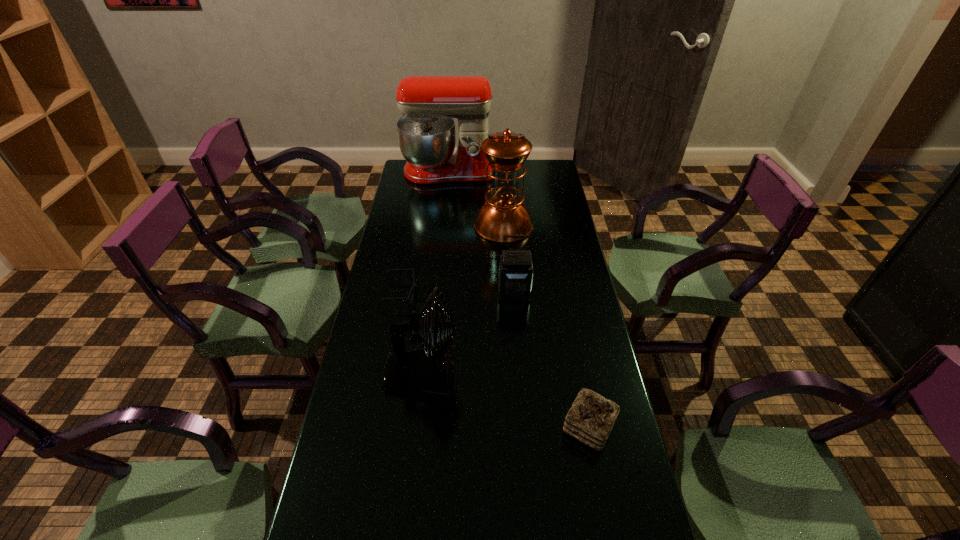
Where is `free spot that satisfies the following two spatial constraints: 1. on the front-facing side of the farthest object; 2. on the front-facing side of the shortest object`? The image size is (960, 540). free spot that satisfies the following two spatial constraints: 1. on the front-facing side of the farthest object; 2. on the front-facing side of the shortest object is located at coordinates (435, 293).